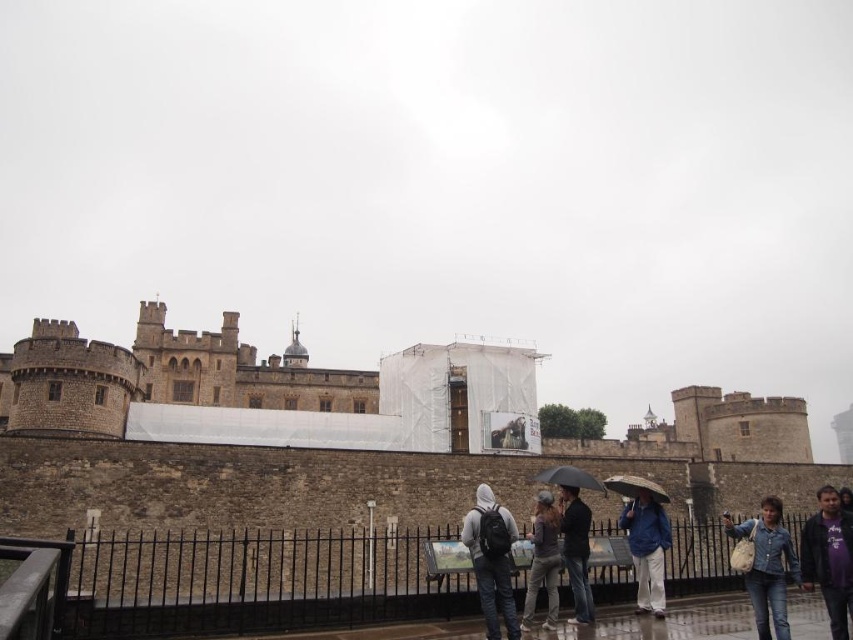
Question: Among these points, which one is farthest from the camera?

Choices:
 (A) (659, 554)
 (B) (579, 504)
 (C) (602, 492)
 (D) (471, 547)

Answer: (C)

Question: Among these objects, which one is nearest to the camera?

Choices:
 (A) brown stone castle at center
 (B) stone medieval castle at left
 (C) dark brown leather jacket at center
 (D) dark gray hoodie at center

Answer: (D)

Question: Is brown stone castle at center to the right of black matte umbrella at center from the viewer's perspective?

Choices:
 (A) no
 (B) yes

Answer: (A)

Question: Considering the relative positions of dark gray jacket at center and transparent plastic umbrella at lower center in the image provided, where is dark gray jacket at center located with respect to transparent plastic umbrella at lower center?

Choices:
 (A) right
 (B) left

Answer: (B)

Question: Is dark gray hoodie at center wider than transparent plastic umbrella at lower center?

Choices:
 (A) no
 (B) yes

Answer: (A)

Question: Which of the following is the closest to the observer?

Choices:
 (A) (848, 602)
 (B) (569, 497)
 (C) (492, 609)
 (D) (646, 595)

Answer: (A)